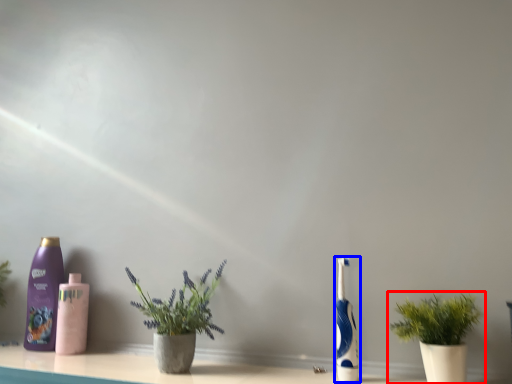
Question: Which point is closer to the camera, houseplant (highlighted by a red box) or toothbrush (highlighted by a blue box)?

Choices:
 (A) houseplant
 (B) toothbrush

Answer: (A)